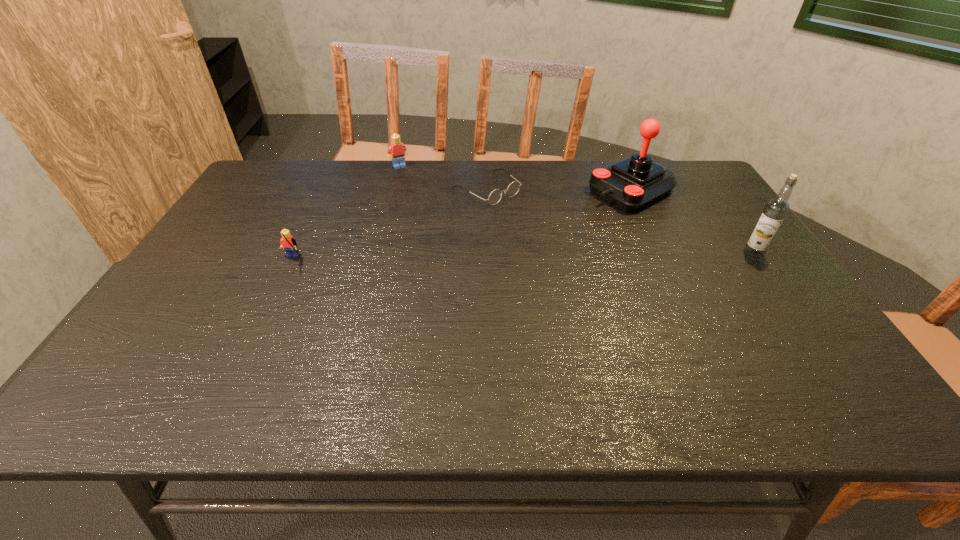
This screenshot has height=540, width=960. I want to click on vacant space on the desktop that is between the left Lego and the vodka and is positioned through the lenses of the shortest object, so click(x=586, y=256).

Find the location of a particular element. The height and width of the screenshot is (540, 960). vacant space on the desktop that is between the leftmost object and the vodka and is positioned on the front-facing side of the right Lego is located at coordinates (459, 258).

Where is `vacant space on the desktop that is between the nearer Lego and the rightmost object and is positioned on the base of the fourth object from left to right`? vacant space on the desktop that is between the nearer Lego and the rightmost object and is positioned on the base of the fourth object from left to right is located at coordinates (496, 258).